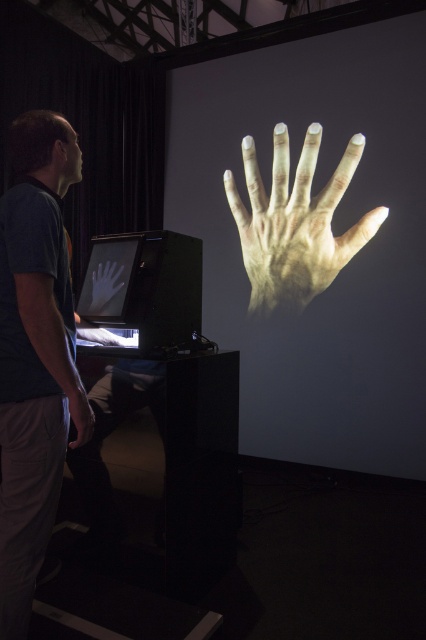
Who is higher up, light beige skin at center or translucent skin hand at lower left?

light beige skin at center is higher up.

Identify the location of light beige skin at center. (294, 224).

Between point (423, 444) and point (330, 179), which one is positioned behind?

The point (330, 179) is more distant.

Between point (377, 406) and point (345, 241), which one is positioned behind?

The point (345, 241) is behind.

You are a GUI agent. You are given a task and a screenshot of the screen. Output one action in this format:
    pyautogui.click(x=<x>, y=<y>)
    Task: Click on the matte white hand at center
    This screenshot has width=426, height=640.
    Given the screenshot: What is the action you would take?
    pyautogui.click(x=333, y=234)

Is point (241, 412) more distant than point (109, 264)?

Yes, it is.

Who is shorter, matte white hand at center or matte black hand at center?

Standing shorter between the two is matte black hand at center.

Describe the element at coordinates (333, 234) in the screenshot. I see `matte white hand at center` at that location.

Locate an element on the screen. matte white hand at center is located at coordinates (333, 234).